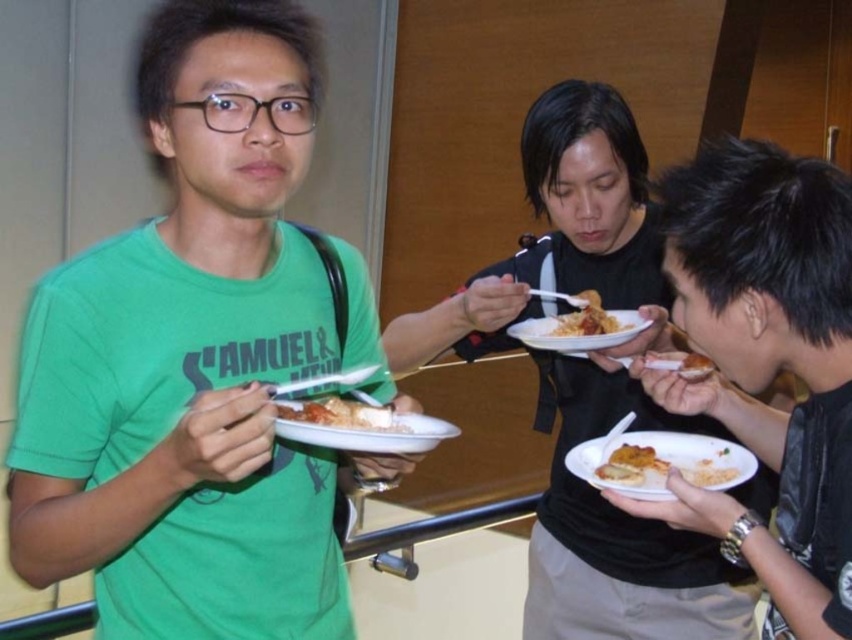
What object is located at the coordinates point (583, 316)?

The shiny plastic fork at center is located at point (583, 316).

You are a food critic who wants to taste the golden crispy bread at center. You have a shiny plastic fork at center in your hand. Can you use this fork to pick up the bread?

The shiny plastic fork at center is bigger than golden crispy bread at center, so yes, the fork can be used to pick up the bread since it is larger in size and likely suitable for handling the bread.